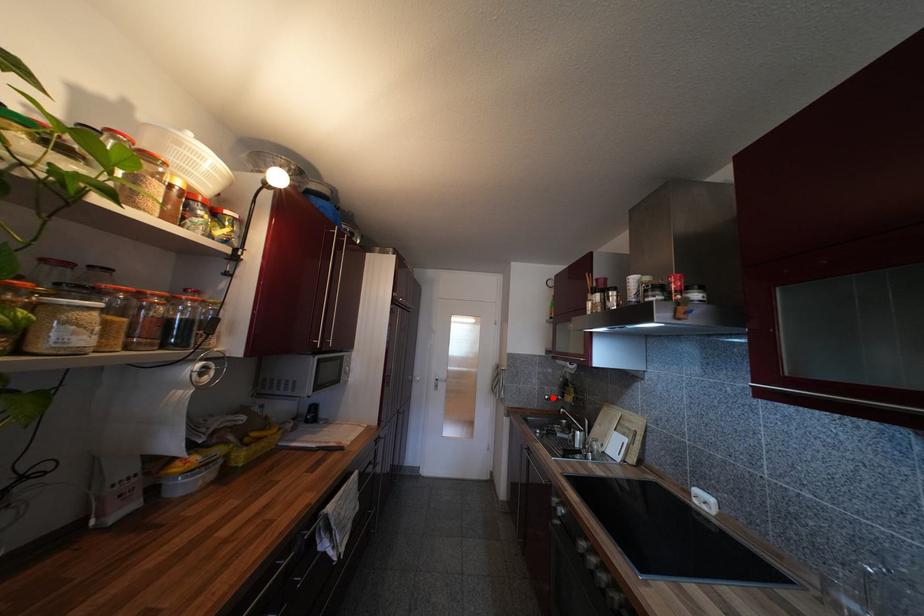
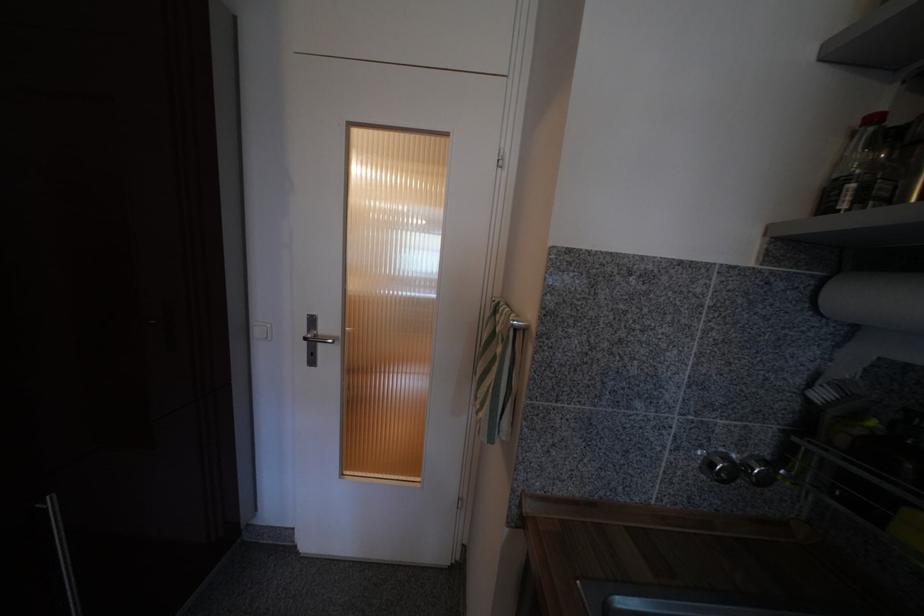
Find the pixel in the second image that matches the highlighted location in the first image.

(730, 460)